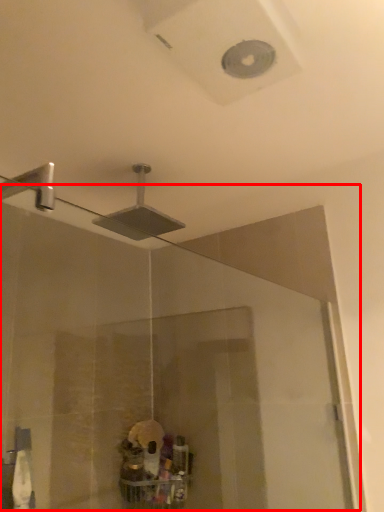
Question: Observing the image, what is the correct spatial positioning of glass door (annotated by the red box) in reference to shower?

Choices:
 (A) right
 (B) left

Answer: (A)